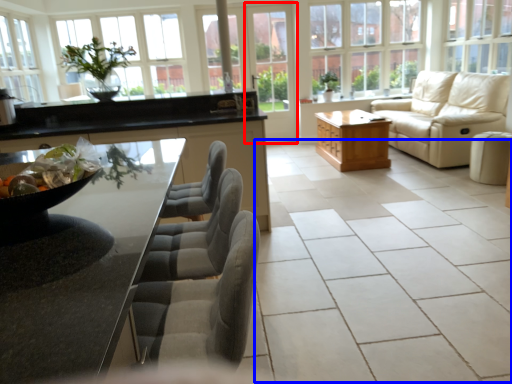
Question: Which point is closer to the camera, screen door (highlighted by a red box) or ceramic tile (highlighted by a blue box)?

Choices:
 (A) screen door
 (B) ceramic tile

Answer: (B)